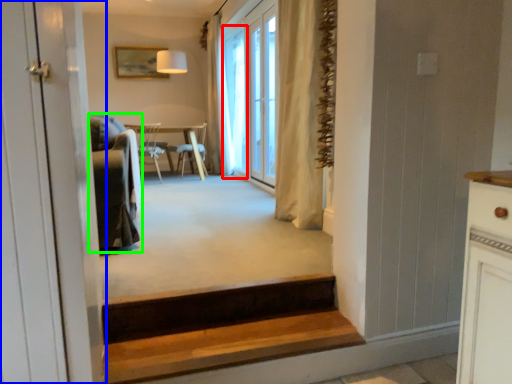
Question: Which object is the farthest from window screen (highlighted by a red box)? Choose among these: door (highlighted by a blue box) or armchair (highlighted by a green box).

Choices:
 (A) door
 (B) armchair

Answer: (A)